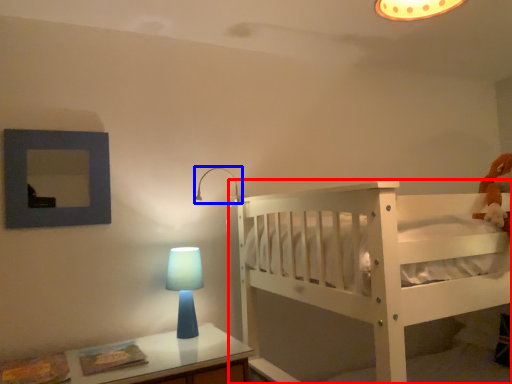
Question: Among these objects, which one is farthest to the camera, infant bed (highlighted by a red box) or lamp (highlighted by a blue box)?

Choices:
 (A) infant bed
 (B) lamp

Answer: (B)